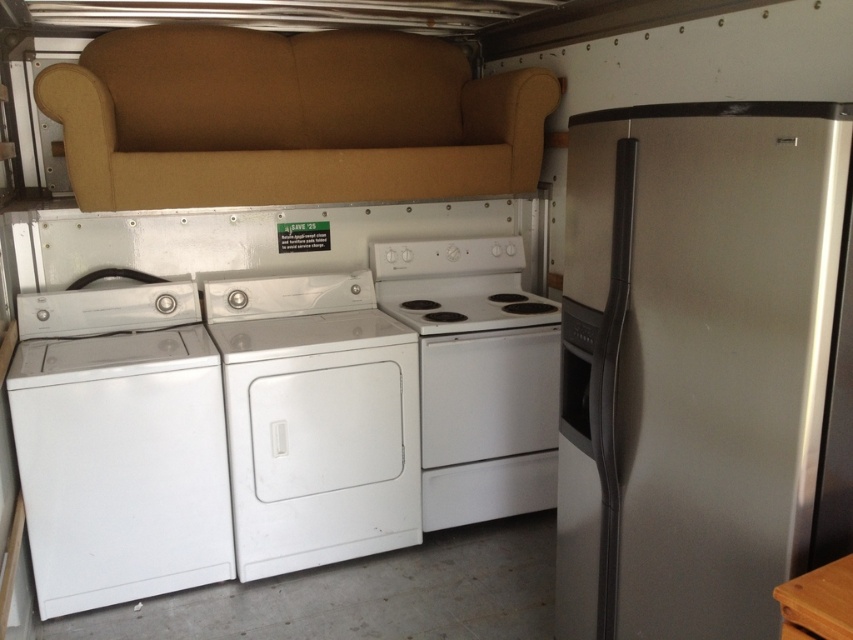
Does white matte/texture dryer at center appear on the right side of white glossy electric stove at center?

Incorrect, white matte/texture dryer at center is not on the right side of white glossy electric stove at center.

Can you confirm if white matte/texture dryer at center is bigger than white glossy electric stove at center?

Yes.

Locate an element on the screen. This screenshot has height=640, width=853. white matte/texture dryer at center is located at coordinates (316, 420).

What do you see at coordinates (289, 120) in the screenshot? Image resolution: width=853 pixels, height=640 pixels. I see `beige fabric couch at upper left` at bounding box center [289, 120].

Where is `beige fabric couch at upper left`? The width and height of the screenshot is (853, 640). beige fabric couch at upper left is located at coordinates (289, 120).

Where is `beige fabric couch at upper left`? This screenshot has width=853, height=640. beige fabric couch at upper left is located at coordinates (289, 120).

Consider the image. Does white glossy washer at center have a smaller size compared to white glossy electric stove at center?

No.

In the scene shown: Can you confirm if white glossy washer at center is positioned below white glossy electric stove at center?

Correct, white glossy washer at center is located below white glossy electric stove at center.

Is point (444, 506) farther from camera compared to point (445, 300)?

No, it is not.

You are a GUI agent. You are given a task and a screenshot of the screen. Output one action in this format:
    pyautogui.click(x=<x>, y=<y>)
    Task: Click on the white glossy washer at center
    The width and height of the screenshot is (853, 640).
    Given the screenshot: What is the action you would take?
    pyautogui.click(x=476, y=374)